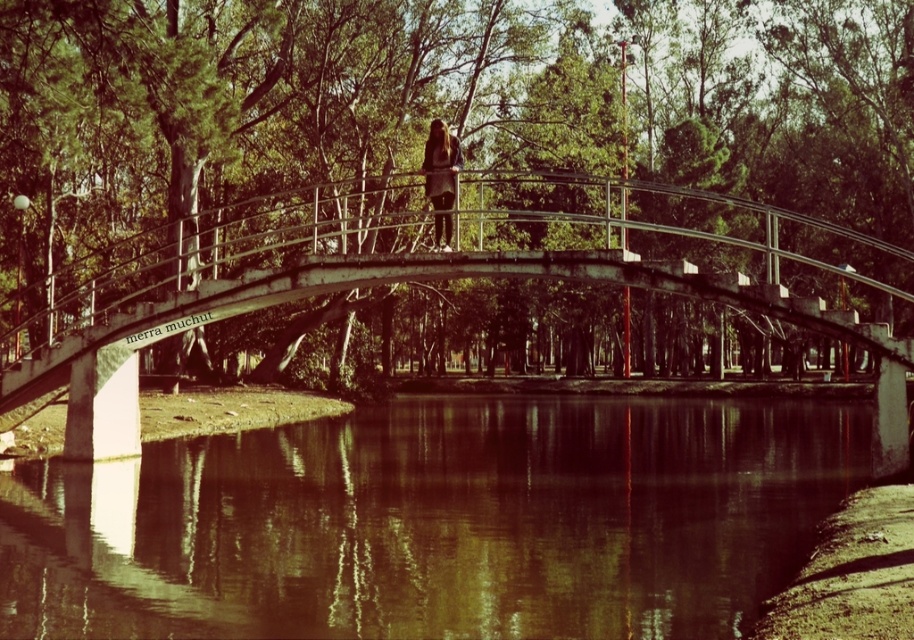
Is brown reflective water at center wider than matte black dress at center?

Yes, brown reflective water at center is wider than matte black dress at center.

Who is taller, brown reflective water at center or matte black dress at center?

matte black dress at center

Locate an element on the screen. This screenshot has width=914, height=640. brown reflective water at center is located at coordinates (434, 522).

In the scene shown: Can you confirm if concrete bridge at center is positioned below matte black dress at center?

Yes, concrete bridge at center is below matte black dress at center.

Who is positioned more to the right, concrete bridge at center or matte black dress at center?

concrete bridge at center is more to the right.

Which is behind, point (394, 268) or point (434, 134)?

The point (434, 134) is behind.

This screenshot has width=914, height=640. I want to click on concrete bridge at center, so click(x=406, y=275).

Can you confirm if brown reflective water at center is shorter than concrete bridge at center?

Yes.

What do you see at coordinates (434, 522) in the screenshot?
I see `brown reflective water at center` at bounding box center [434, 522].

Is point (550, 461) closer to camera compared to point (815, 326)?

That is False.

Locate an element on the screen. brown reflective water at center is located at coordinates (434, 522).